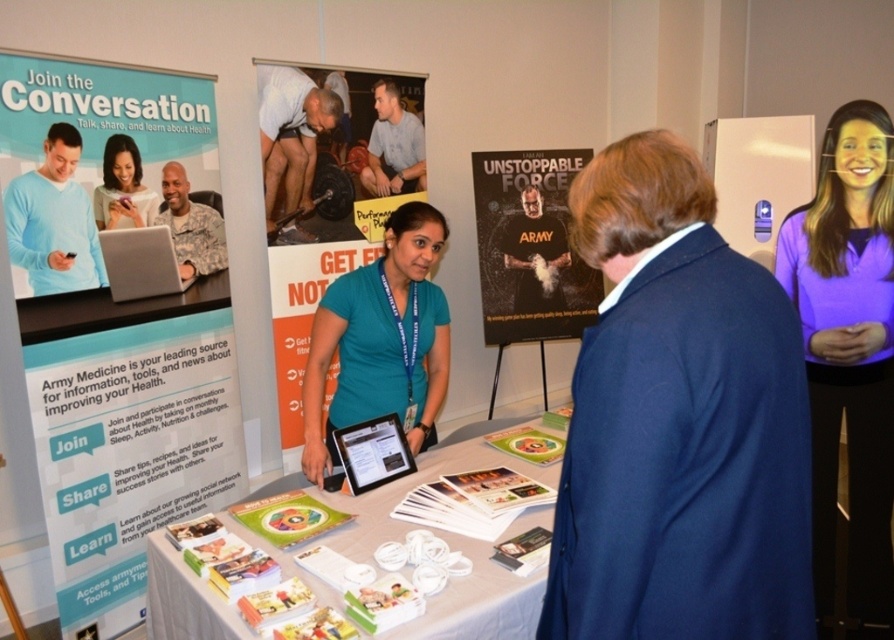
Question: Among these points, which one is nearest to the camera?

Choices:
 (A) (48, 496)
 (B) (73, 180)
 (C) (862, 240)

Answer: (A)

Question: Is blue woolen jacket at center smaller than army t-shirt at center?

Choices:
 (A) no
 (B) yes

Answer: (A)

Question: Among these objects, which one is farthest from the camera?

Choices:
 (A) matte black phone at upper left
 (B) matte paper poster at upper left
 (C) white paper table at center

Answer: (A)

Question: Is matte paper poster at upper left closer to the viewer compared to metallic silver poster at center?

Choices:
 (A) yes
 (B) no

Answer: (A)

Question: Which of the following is the closest to the observer?

Choices:
 (A) metallic silver poster at center
 (B) white paper at center

Answer: (B)

Question: Does purple matte shirt at upper right have a lesser width compared to army t-shirt at center?

Choices:
 (A) yes
 (B) no

Answer: (B)